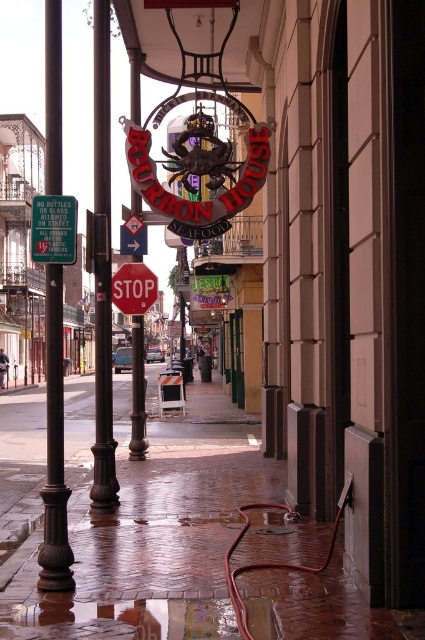
Question: Is wet brick pavement at center thinner than white plastic arrow at center?

Choices:
 (A) no
 (B) yes

Answer: (A)

Question: Which point appears farthest from the camera in this image?

Choices:
 (A) coord(127,300)
 (B) coord(45,237)
 (C) coord(135,253)
 (D) coord(102,452)

Answer: (C)

Question: Based on their relative distances, which object is nearer to the white plastic arrow at center?

Choices:
 (A) polished metal pole at center
 (B) wet brick pavement at center
 (C) black metal pole at left

Answer: (A)

Question: Is dark brown polished metal pole at left thinner than black metal pole at left?

Choices:
 (A) yes
 (B) no

Answer: (B)

Question: Observing the image, what is the correct spatial positioning of dark brown polished metal pole at left in reference to white plastic arrow at center?

Choices:
 (A) above
 (B) below

Answer: (A)

Question: Among these objects, which one is nearest to the camera?

Choices:
 (A) polished metal pole at center
 (B) black metal pole at left
 (C) red glossy stop sign at center

Answer: (B)